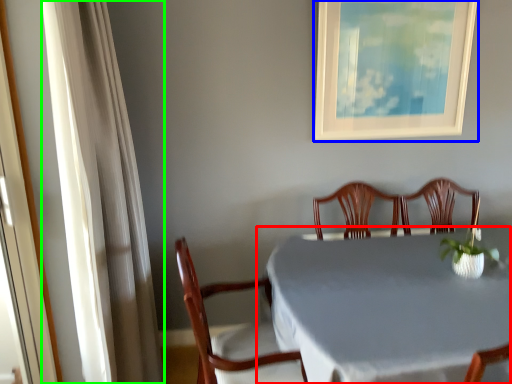
Question: Considering the real-world distances, which object is closest to table (highlighted by a red box)? picture frame (highlighted by a blue box) or curtain (highlighted by a green box).

Choices:
 (A) picture frame
 (B) curtain

Answer: (B)